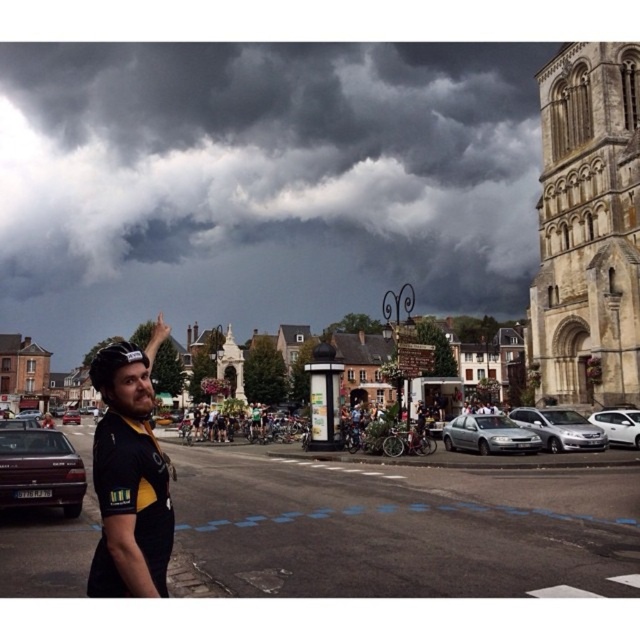
Question: Considering the real-world distances, which object is farthest from the matte black sedan at left?

Choices:
 (A) white glossy sedan at right
 (B) black jersey at left
 (C) satin silver sedan at center

Answer: (A)

Question: Is satin silver sedan at center bigger than matte black car at left?

Choices:
 (A) yes
 (B) no

Answer: (B)

Question: Does black jersey at left lie in front of satin silver sedan at center?

Choices:
 (A) yes
 (B) no

Answer: (A)

Question: Considering the real-world distances, which object is farthest from the matte black sedan at left?

Choices:
 (A) white glossy sedan at right
 (B) silver metallic sedan at center-right

Answer: (A)

Question: Can you confirm if silver metallic sedan at center-right is positioned to the right of matte black car at left?

Choices:
 (A) yes
 (B) no

Answer: (A)

Question: Estimate the real-world distances between objects in this image. Which object is farther from the black jersey at left?

Choices:
 (A) silver metallic sedan at center-right
 (B) satin silver sedan at center
 (C) white glossy sedan at right
 (D) matte black car at left

Answer: (D)